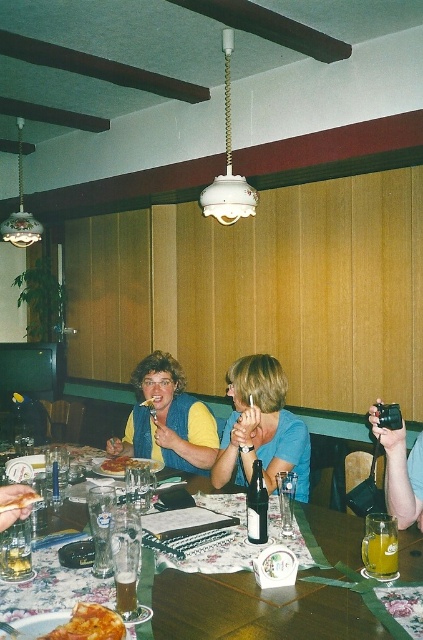
Between golden crispy pizza slice at lower left and translucent glass beer at table center, which one appears on the left side from the viewer's perspective?

Positioned to the left is translucent glass beer at table center.

Between golden crispy pizza slice at lower left and translucent glass beer at table center, which one has less height?

With less height is golden crispy pizza slice at lower left.

Is point (82, 605) farther from camera compared to point (18, 568)?

That is False.

Locate an element on the screen. Image resolution: width=423 pixels, height=640 pixels. golden crispy pizza slice at lower left is located at coordinates (90, 625).

Measure the distance between point (378, 566) and camera.

The distance of point (378, 566) from camera is 4.68 feet.

Does translucent glass mug at table center have a lesser height compared to translucent glass beer at table center?

No.

Is point (368, 556) positioned behind point (21, 545)?

That is False.

I want to click on translucent glass mug at table center, so click(x=379, y=554).

Does golden crispy pizza slice at lower left have a greater width compared to translucent glass at table center?

Yes.

Is golden crispy pizza slice at lower left positioned at the back of translucent glass at table center?

No, golden crispy pizza slice at lower left is closer to the viewer.

Describe the element at coordinates (90, 625) in the screenshot. I see `golden crispy pizza slice at lower left` at that location.

The width and height of the screenshot is (423, 640). In order to click on golden crispy pizza slice at lower left in this screenshot , I will do `click(90, 625)`.